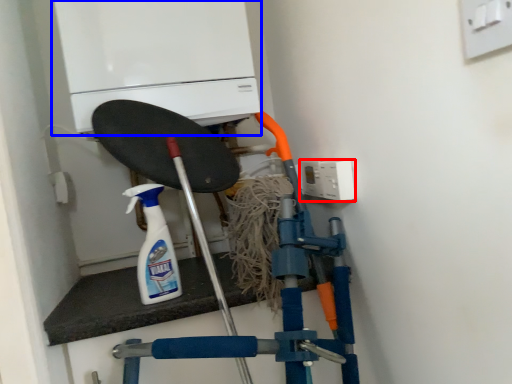
Question: Which point is closer to the camera, electric outlet (highlighted by a red box) or home appliance (highlighted by a blue box)?

Choices:
 (A) electric outlet
 (B) home appliance

Answer: (A)